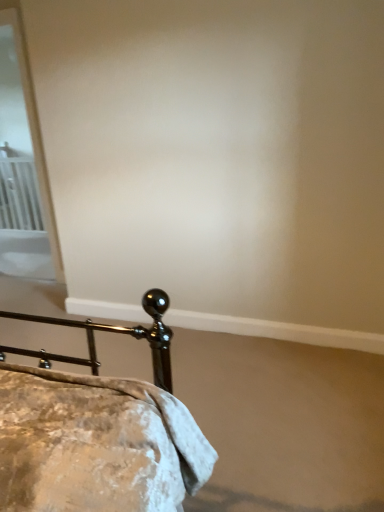
Where is `vacant space situated above metallic gold bed at lower left (from a real-world perspective)`? The image size is (384, 512). vacant space situated above metallic gold bed at lower left (from a real-world perspective) is located at coordinates (182, 359).